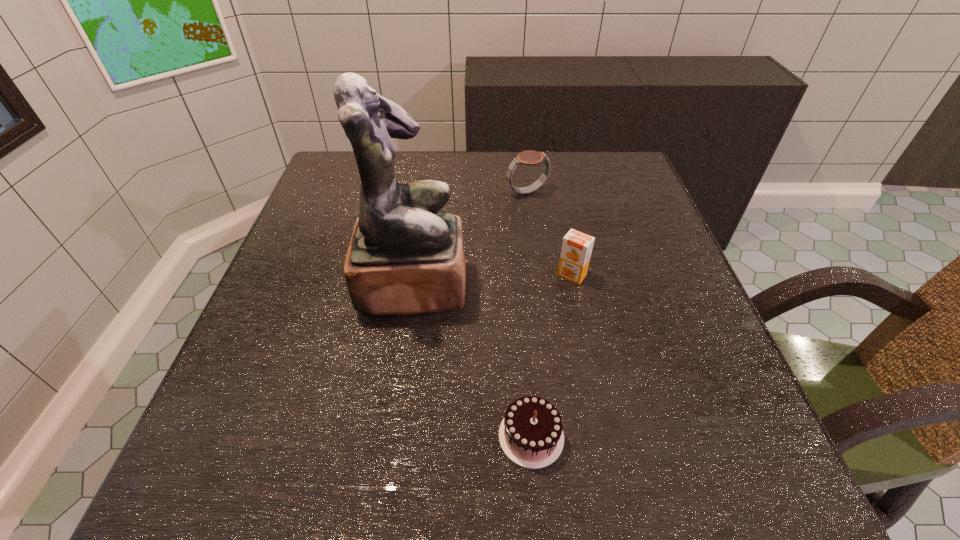
Locate an element on the screen. The width and height of the screenshot is (960, 540). object located in the far edge section of the desktop is located at coordinates (529, 157).

Locate an element on the screen. The width and height of the screenshot is (960, 540). object that is at the near edge is located at coordinates (531, 435).

Image resolution: width=960 pixels, height=540 pixels. Find the location of `vacant area at the far edge of the desktop`. vacant area at the far edge of the desktop is located at coordinates (487, 168).

Find the location of a particular element. vacant space at the near edge of the desktop is located at coordinates (374, 475).

In order to click on vacant space at the right edge of the desktop in this screenshot , I will do `click(607, 232)`.

At what (x,y) coordinates should I click in order to perform the action: click on free space at the far left corner. Please return your answer as a coordinate pair (x, y). The image size is (960, 540). Looking at the image, I should click on (354, 185).

Find the location of a particular element. Image resolution: width=960 pixels, height=540 pixels. vacant space at the far right corner of the desktop is located at coordinates (613, 178).

The image size is (960, 540). What are the coordinates of `free region at the near right corner` in the screenshot? It's located at (771, 467).

Identify the location of vacant space that is in between the tallest object and the shortest object. (472, 360).

Find the location of a particular element. vacant area that lies between the sculpture and the chocolate cake is located at coordinates (472, 360).